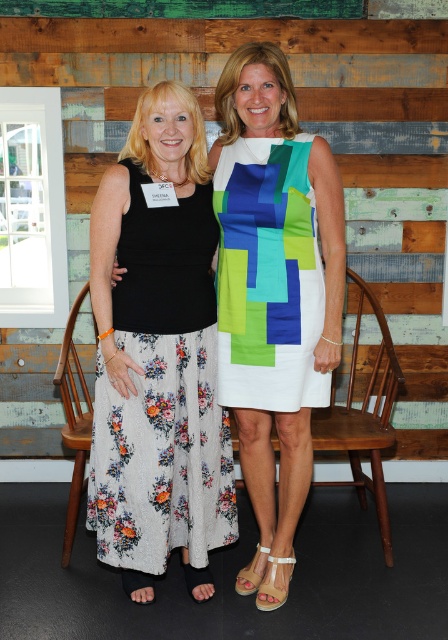
Question: Which of these objects is positioned farthest from the silky multicolored dress at center?

Choices:
 (A) floral cotton dress at left
 (B) wooden paneling at upper center

Answer: (B)

Question: Is wooden paneling at upper center smaller than black floral skirt at left?

Choices:
 (A) no
 (B) yes

Answer: (A)

Question: Which object is the closest to the wooden paneling at upper center?

Choices:
 (A) silky multicolored dress at center
 (B) black floral skirt at left
 (C) floral cotton dress at left

Answer: (B)

Question: Which of the following is the farthest from the observer?

Choices:
 (A) wooden paneling at upper center
 (B) silky multicolored dress at center

Answer: (A)

Question: Is wooden paneling at upper center below floral cotton dress at left?

Choices:
 (A) no
 (B) yes

Answer: (A)

Question: Is wooden paneling at upper center below floral cotton dress at left?

Choices:
 (A) yes
 (B) no

Answer: (B)